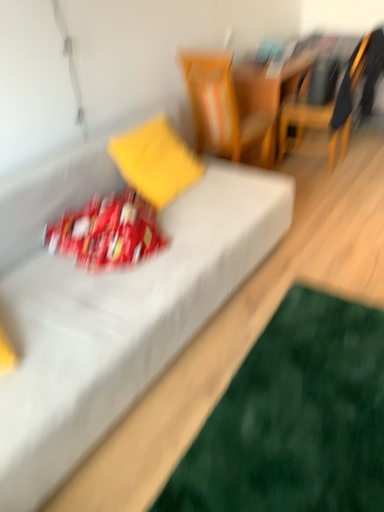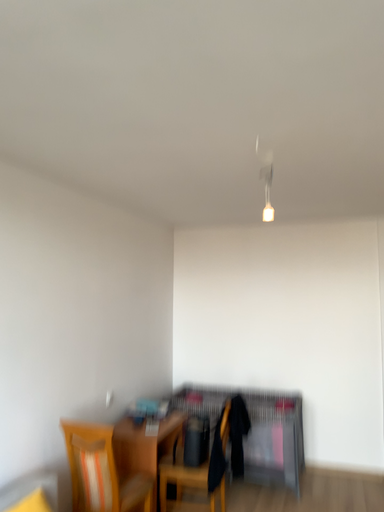
Question: How did the camera likely rotate when shooting the video?

Choices:
 (A) rotated right
 (B) rotated left

Answer: (A)